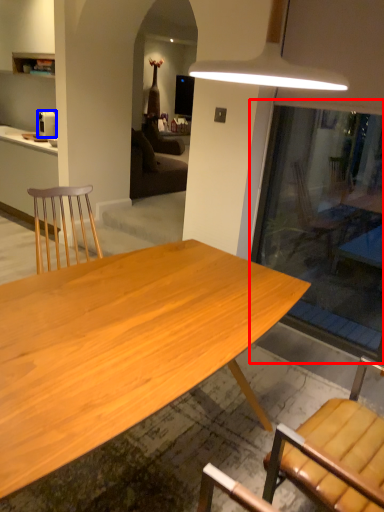
Question: Which object is closer to the camera taking this photo, glass door (highlighted by a red box) or coffee maker (highlighted by a blue box)?

Choices:
 (A) glass door
 (B) coffee maker

Answer: (A)